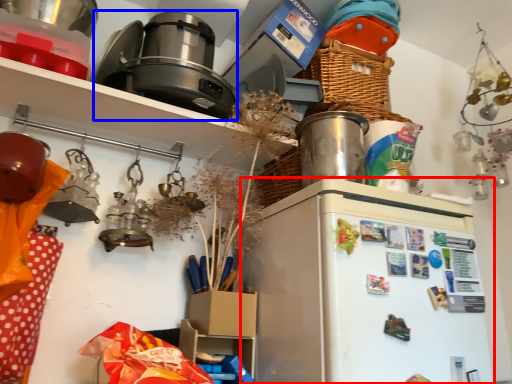
Question: Which object appears closest to the camera in this image, fridge (highlighted by a red box) or appliance (highlighted by a blue box)?

Choices:
 (A) fridge
 (B) appliance

Answer: (A)